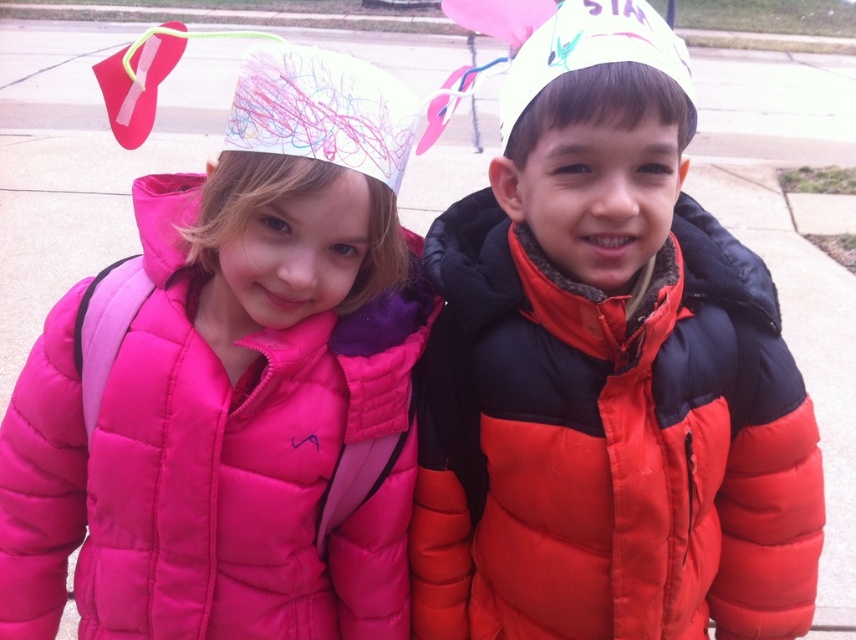
Where is the matte black jacket at center located in the image?

The matte black jacket at center is located at point [605,374] in the image.

In the scene shown: You are a delivery drone that needs to deliver a package to the matte pink puffer jacket at upper left. However, you must avoid coming within 12 inches of the matte black jacket at center. Based on the scene, can you safely deliver the package without violating the safety distance?

The distance between the matte black jacket at center and matte pink puffer jacket at upper left is 10.28 inches, which is less than the required 12 inches safety distance. Therefore, the drone cannot safely deliver the package without violating the safety distance.

Based on the photo, you are a photographer taking a picture of the two children in the scene. You notice two points marked in the image. Which point, point [752,324] or point [337,154], is closer to your camera lens?

Point [752,324] is closer to the camera lens because it is further to the viewer than point [337,154].